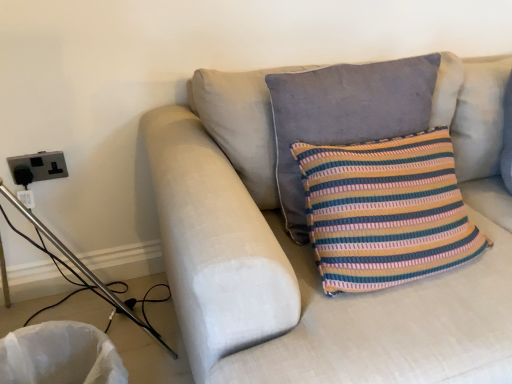
Question: Is the depth of light beige fabric couch at center less than that of striped fabric pillow at center, marked as the second pillow in a right-to-left arrangement?

Choices:
 (A) yes
 (B) no

Answer: (A)

Question: Is light beige fabric couch at center wider than striped fabric pillow at center, positioned as the first pillow in left-to-right order?

Choices:
 (A) yes
 (B) no

Answer: (A)

Question: Would you say light beige fabric couch at center is a long distance from striped fabric pillow at center, positioned as the first pillow in left-to-right order?

Choices:
 (A) yes
 (B) no

Answer: (B)

Question: Is light beige fabric couch at center not inside striped fabric pillow at center, positioned as the first pillow in left-to-right order?

Choices:
 (A) yes
 (B) no

Answer: (A)

Question: Can you confirm if light beige fabric couch at center is smaller than striped fabric pillow at center, positioned as the first pillow in left-to-right order?

Choices:
 (A) yes
 (B) no

Answer: (B)

Question: From a real-world perspective, is striped fabric cushion at upper right, marked as the second pillow in a left-to-right arrangement, positioned above or below light beige fabric couch at center?

Choices:
 (A) above
 (B) below

Answer: (A)

Question: Does point (496, 82) appear closer or farther from the camera than point (224, 372)?

Choices:
 (A) farther
 (B) closer

Answer: (A)

Question: Is striped fabric cushion at upper right, marked as the second pillow in a left-to-right arrangement, in front of or behind light beige fabric couch at center in the image?

Choices:
 (A) front
 (B) behind

Answer: (B)

Question: Considering the relative positions of striped fabric cushion at upper right, marked as the second pillow in a left-to-right arrangement, and light beige fabric couch at center in the image provided, is striped fabric cushion at upper right, marked as the second pillow in a left-to-right arrangement, to the left or to the right of light beige fabric couch at center?

Choices:
 (A) right
 (B) left

Answer: (A)

Question: Considering their positions, is striped fabric cushion at upper right, positioned as the 1th pillow in right-to-left order, located in front of or behind black plastic outlet at left?

Choices:
 (A) front
 (B) behind

Answer: (A)

Question: Would you say striped fabric cushion at upper right, marked as the second pillow in a left-to-right arrangement, is to the left or to the right of black plastic outlet at left in the picture?

Choices:
 (A) left
 (B) right

Answer: (B)

Question: From a real-world perspective, is striped fabric cushion at upper right, marked as the second pillow in a left-to-right arrangement, physically located above or below black plastic outlet at left?

Choices:
 (A) below
 (B) above

Answer: (B)

Question: Is striped fabric cushion at upper right, marked as the second pillow in a left-to-right arrangement, taller or shorter than black plastic outlet at left?

Choices:
 (A) short
 (B) tall

Answer: (B)

Question: From their relative heights in the image, would you say light beige fabric couch at center is taller or shorter than black plastic outlet at left?

Choices:
 (A) short
 (B) tall

Answer: (B)

Question: Which is correct: light beige fabric couch at center is inside black plastic outlet at left, or outside of it?

Choices:
 (A) inside
 (B) outside

Answer: (B)